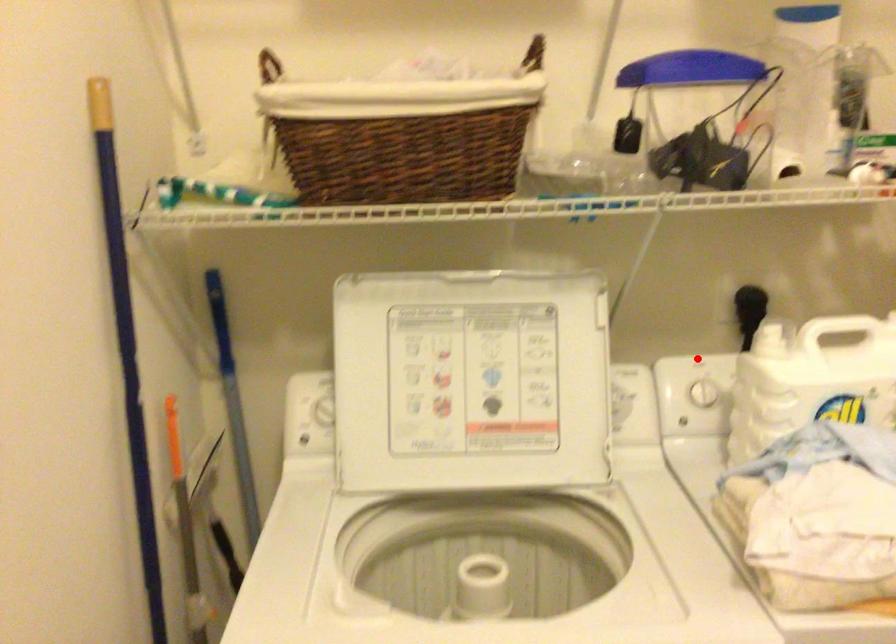
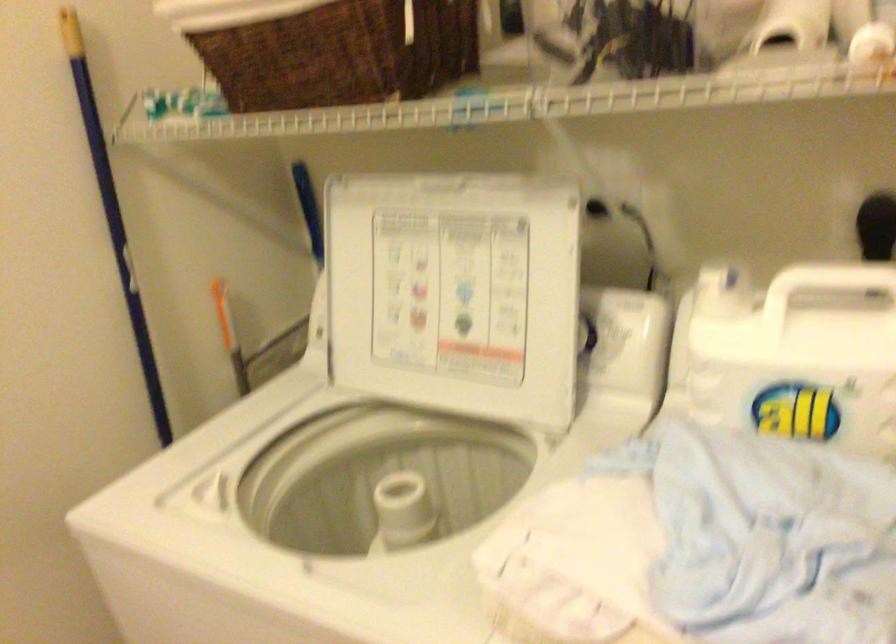
Question: I am providing you with two images of the same scene from different viewpoints. Given a red point in image1, look at the same physical point in image2. Is it:

Choices:
 (A) Closer to the viewpoint
 (B) Farther from the viewpoint

Answer: (A)